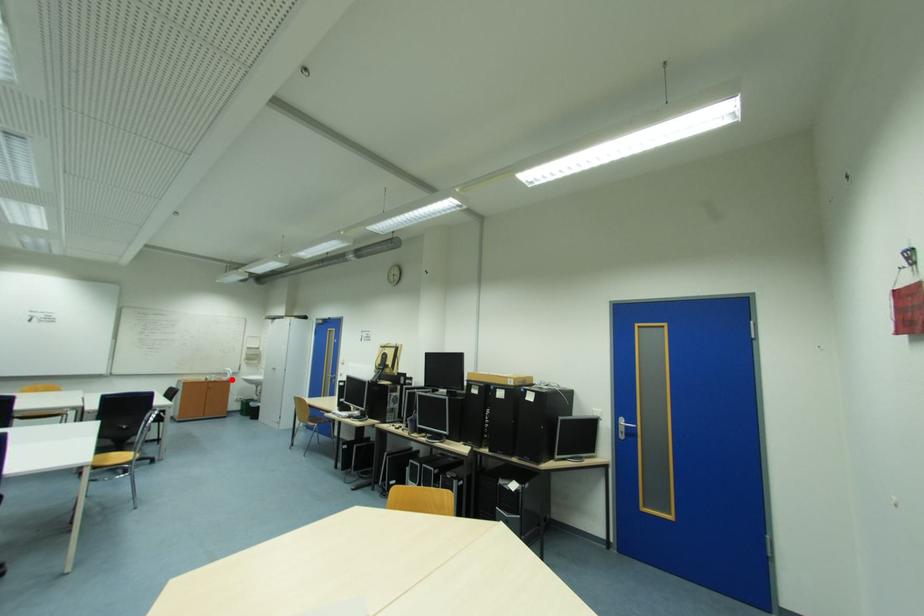
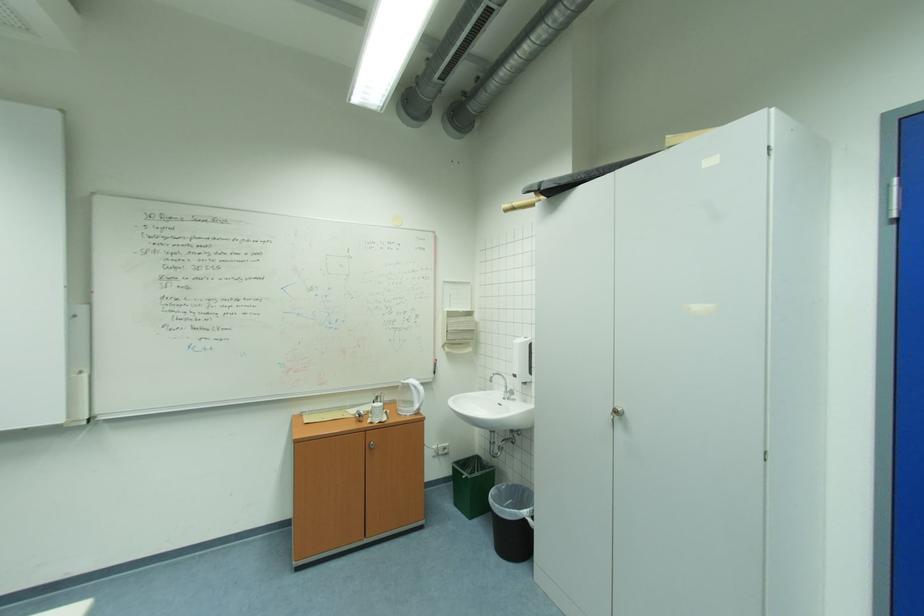
Question: I am providing you with two images of the same scene from different viewpoints. In image1, a red point is highlighted. Considering the same 3D point in image2, which of the following is correct?

Choices:
 (A) It is closer
 (B) It is farther

Answer: (B)